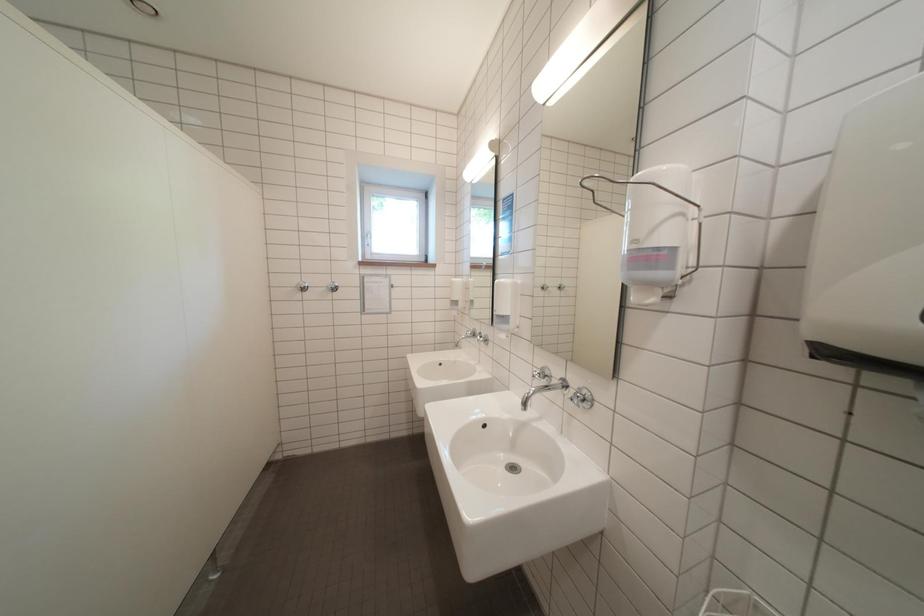
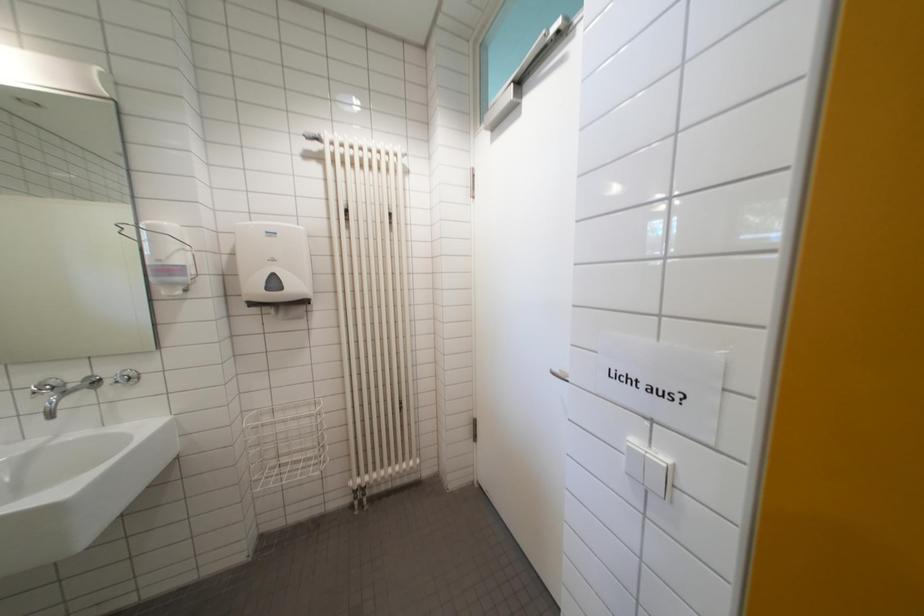
Question: The camera is either moving clockwise (left) or counter-clockwise (right) around the object. The first image is from the beginning of the video and the second image is from the end. Is the camera moving left or right when shooting the video?

Choices:
 (A) Left
 (B) Right

Answer: (A)